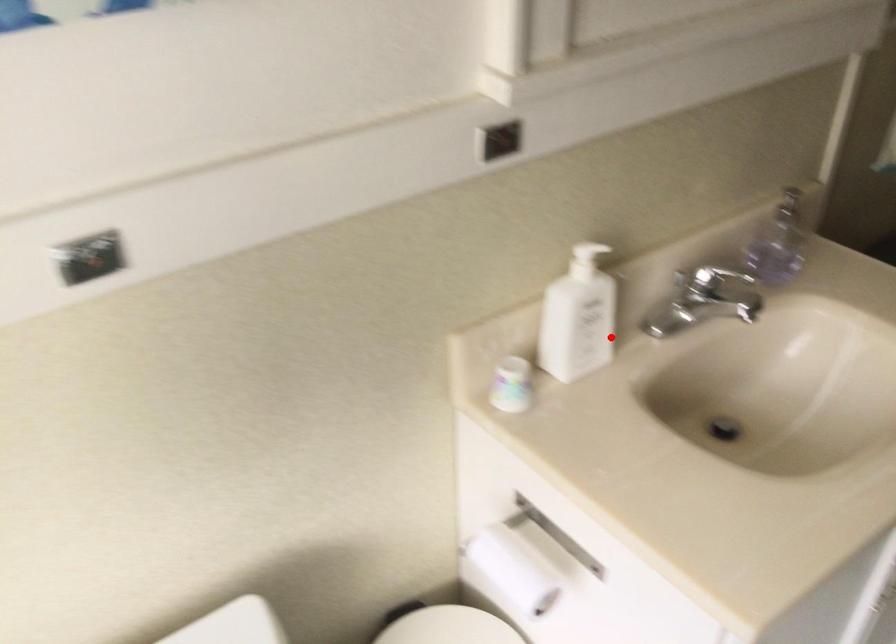
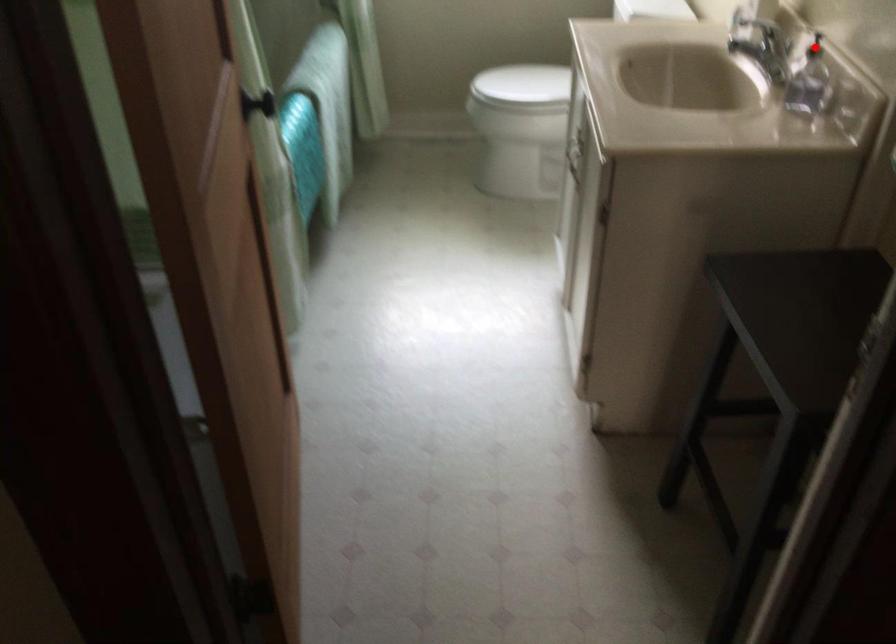
I am providing you with two images of the same scene from different viewpoints. A red point is marked on the first image and another point is marked on the second image. Is the marked point in image1 the same physical position as the marked point in image2?

No